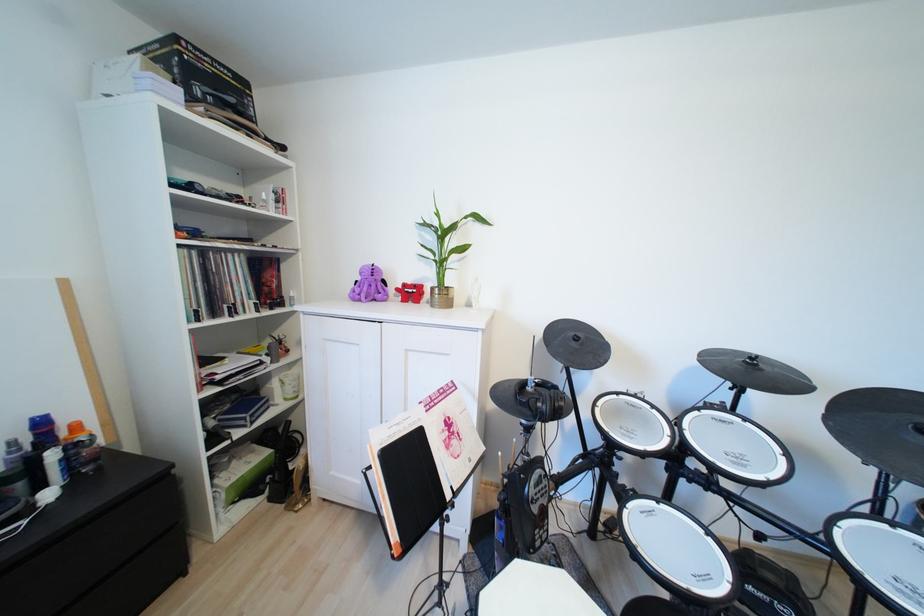
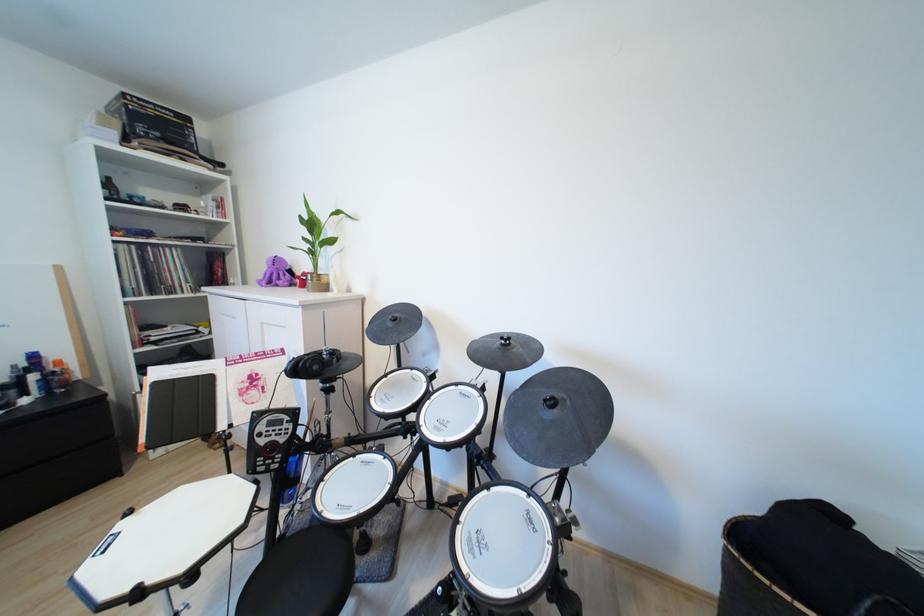
The point at (411, 286) is marked in the first image. Where is the corresponding point in the second image?

(310, 275)